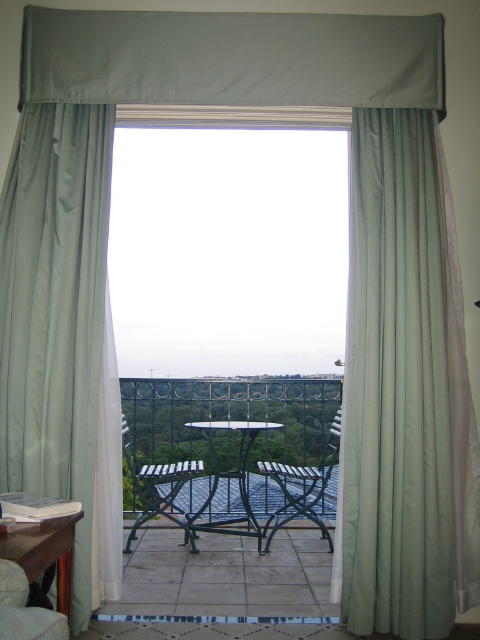
Question: Among these objects, which one is farthest from the camera?

Choices:
 (A) metallic green armchair at center
 (B) velvet beige armchair at lower left
 (C) metallic blue armchair at center
 (D) metallic wrought iron table at center

Answer: (A)

Question: Which is nearer to the wooden table at lower left?

Choices:
 (A) metallic blue armchair at center
 (B) satin fabric curtain at right

Answer: (B)

Question: Can you confirm if satin fabric curtain at right is smaller than metallic blue armchair at center?

Choices:
 (A) yes
 (B) no

Answer: (B)

Question: Where is metallic green armchair at center located in relation to velvet beige armchair at lower left in the image?

Choices:
 (A) right
 (B) left

Answer: (A)

Question: Does satin fabric curtain at right have a greater width compared to wooden table at lower left?

Choices:
 (A) no
 (B) yes

Answer: (B)

Question: Which of the following is the closest to the observer?

Choices:
 (A) [371, 532]
 (B) [54, 532]

Answer: (B)